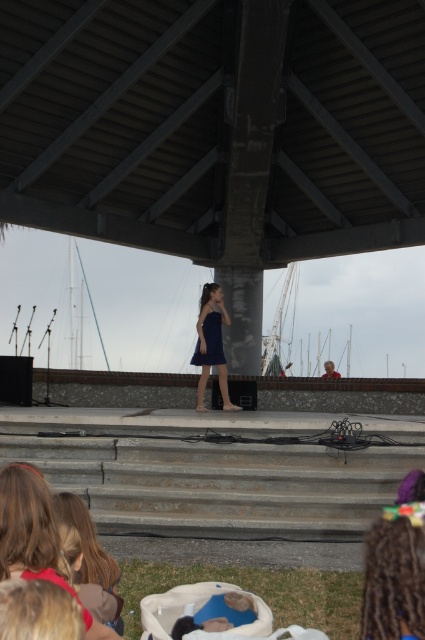
Question: In this image, where is navy satin dress at center located relative to satin blue dress at center?

Choices:
 (A) above
 (B) below

Answer: (B)

Question: Is navy satin dress at center bigger than satin blue dress at center?

Choices:
 (A) yes
 (B) no

Answer: (A)

Question: Can you confirm if navy satin dress at center is smaller than satin blue dress at center?

Choices:
 (A) no
 (B) yes

Answer: (A)

Question: Which of the following is the closest to the observer?

Choices:
 (A) (221, 348)
 (B) (204, 328)

Answer: (B)

Question: Which object appears farthest from the camera in this image?

Choices:
 (A) navy satin dress at center
 (B) satin blue dress at center

Answer: (B)